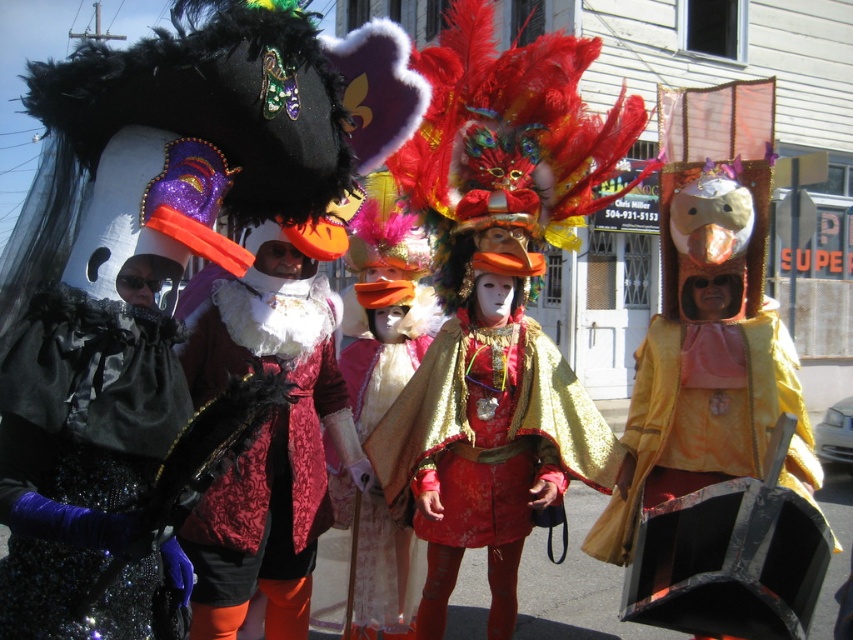
Does point (250, 548) lie in front of point (654, 401)?

Yes.

Where is `velvet/red dress at center`? velvet/red dress at center is located at coordinates (262, 428).

Is shiny black fabric at left shorter than velvet pink cape at center?

Yes.

How far apart are shiny black fabric at left and velvet pink cape at center?

shiny black fabric at left and velvet pink cape at center are 3.19 meters apart from each other.

This screenshot has height=640, width=853. Identify the location of shiny black fabric at left. (77, 440).

Between velvet/red dress at center and velvet pink cape at center, which one appears on the right side from the viewer's perspective?

velvet pink cape at center

Is velvet/red dress at center to the right of velvet pink cape at center from the viewer's perspective?

Incorrect, velvet/red dress at center is not on the right side of velvet pink cape at center.

Which is in front, point (328, 515) or point (378, 403)?

Point (328, 515) is in front.

Find the location of a particular element. The image size is (853, 640). velvet/red dress at center is located at coordinates click(x=262, y=428).